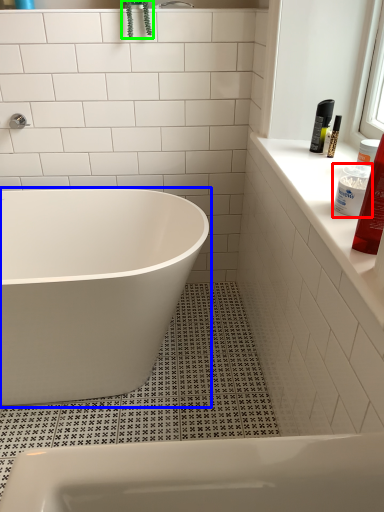
Question: Considering the real-world distances, which object is closest to cleaning product (highlighted by a red box)? bathtub (highlighted by a blue box) or plant (highlighted by a green box).

Choices:
 (A) bathtub
 (B) plant

Answer: (A)